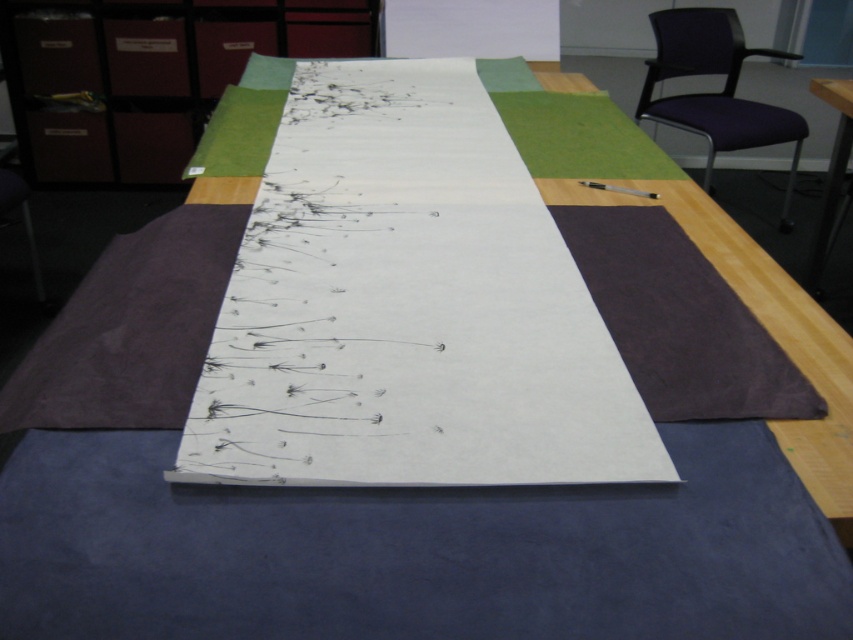
You are an artist working on the large piece of paper with a black ink drawing of dandelion seeds. You need to move to the purple fabric chair at upper right to review your work. Based on the coordinates provided, is the chair positioned to the left or right of the center of the image?

The purple fabric chair at upper right is located at point 0.145 on the x and 0.839 on the y. Since the x coordinate is less than 0.5, it is positioned to the left of the center of the image.